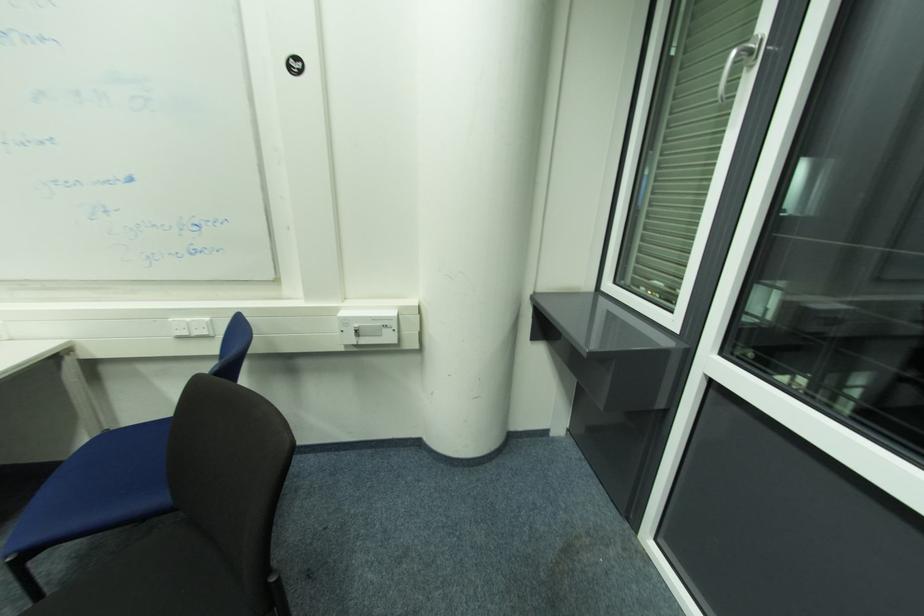
Describe the element at coordinates (190, 328) in the screenshot. Image resolution: width=924 pixels, height=616 pixels. I see `a white power outlet` at that location.